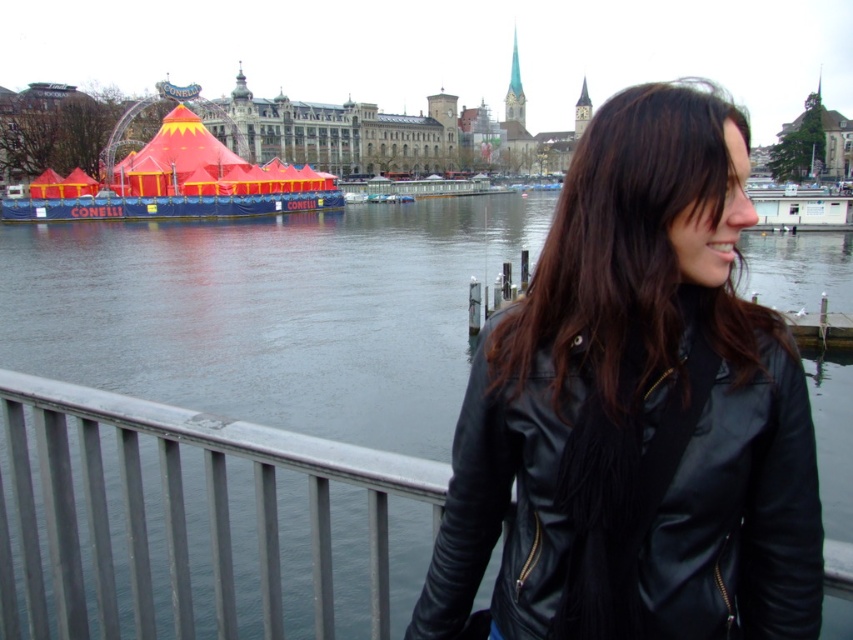
This screenshot has width=853, height=640. Describe the element at coordinates (636, 410) in the screenshot. I see `black leather jacket at center` at that location.

Who is more distant from viewer, (x=717, y=282) or (x=570, y=314)?

Positioned behind is point (x=570, y=314).

Who is more forward, (460, 518) or (636, 381)?

Point (636, 381) is more forward.

You are a GUI agent. You are given a task and a screenshot of the screen. Output one action in this format:
    pyautogui.click(x=<x>, y=<y>)
    Task: Click on the black leather jacket at center
    
    Given the screenshot: What is the action you would take?
    pyautogui.click(x=636, y=410)

Does black leather jacket at center have a greater width compared to dark blue water at center?

No, black leather jacket at center is not wider than dark blue water at center.

Is black leather jacket at center shorter than dark blue water at center?

Indeed, black leather jacket at center has a lesser height compared to dark blue water at center.

Does point (653, 220) lie behind point (453, 264)?

That is False.

Identify the location of black leather jacket at center. (636, 410).

Is dark blue water at center behind black leather jacket at right?

Yes, it is.

Locate an element on the screen. The height and width of the screenshot is (640, 853). dark blue water at center is located at coordinates (270, 310).

Which is behind, point (270, 298) or point (708, 115)?

The point (270, 298) is behind.

The height and width of the screenshot is (640, 853). In order to click on dark blue water at center in this screenshot , I will do `click(270, 310)`.